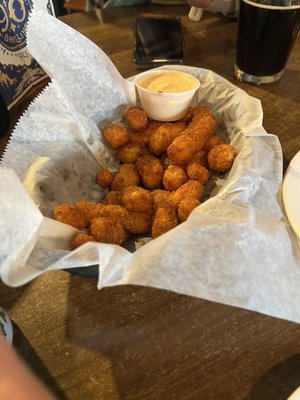
Locate an element on the screen. The width and height of the screenshot is (300, 400). wooden tabletop is located at coordinates (62, 315).